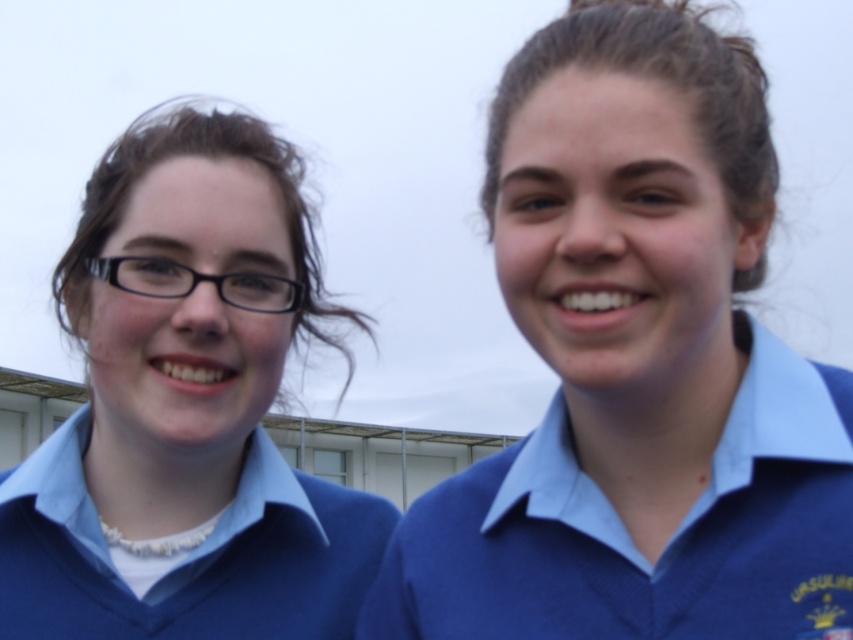
Is blue matte sweater at right smaller than blue jersey at center?

Actually, blue matte sweater at right might be larger than blue jersey at center.

Is point (647, 376) more distant than point (16, 566)?

No.

You are a GUI agent. You are given a task and a screenshot of the screen. Output one action in this format:
    pyautogui.click(x=<x>, y=<y>)
    Task: Click on the blue matte sweater at right
    Image resolution: width=853 pixels, height=640 pixels.
    Given the screenshot: What is the action you would take?
    pyautogui.click(x=637, y=365)

Describe the element at coordinates (186, 406) in the screenshot. I see `matte blue sweater at left` at that location.

Does point (126, 538) lie behind point (378, 545)?

No, (126, 538) is closer to viewer.

Identify the location of matte blue sweater at left. (186, 406).

Is blue matte sweater at right to the left of matte blue sweater at left from the viewer's perspective?

No, blue matte sweater at right is not to the left of matte blue sweater at left.

Which is more to the left, blue matte sweater at right or matte blue sweater at left?

matte blue sweater at left is more to the left.

Locate an element on the screen. The width and height of the screenshot is (853, 640). blue matte sweater at right is located at coordinates (637, 365).